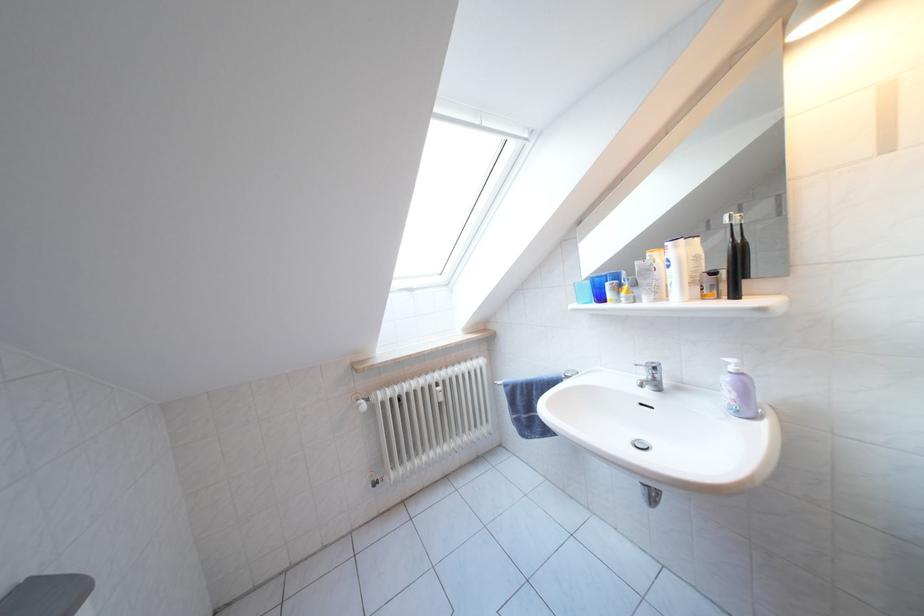
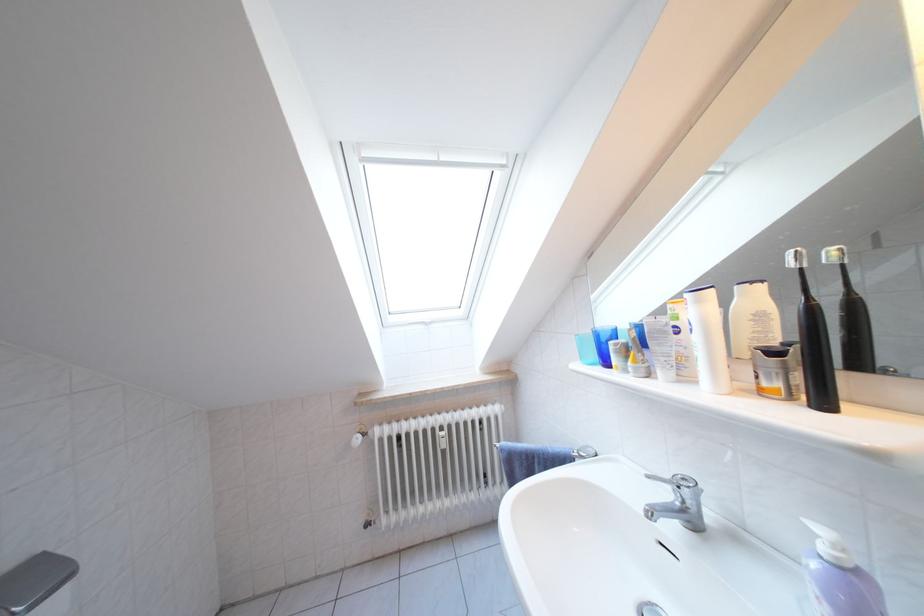
In the second image, find the point that corresponds to pixel 722 278 in the first image.

(783, 359)